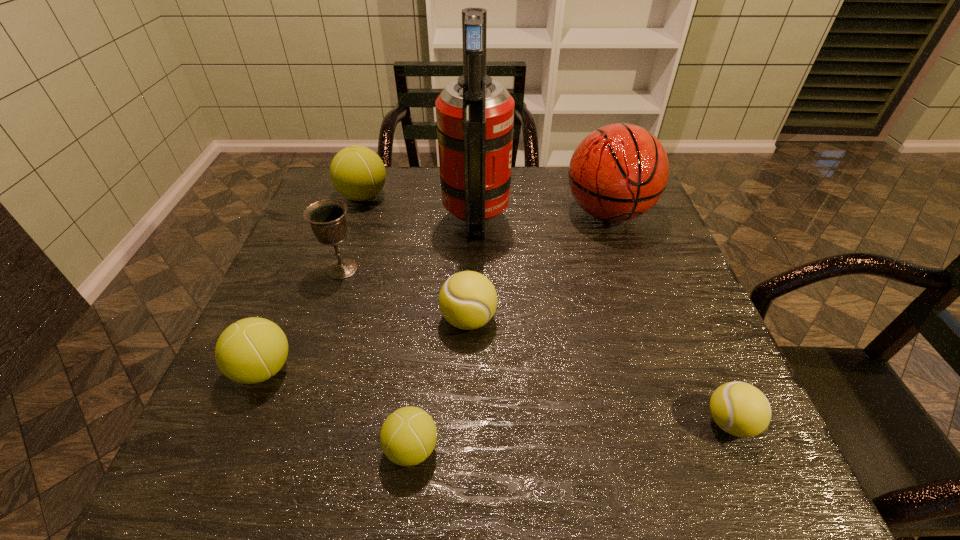
Locate an element on the screen. the third nearest tennis ball is located at coordinates (251, 350).

Find the location of a particular element. The width and height of the screenshot is (960, 540). the smaller yellow tennis ball is located at coordinates (740, 409).

Image resolution: width=960 pixels, height=540 pixels. Identify the location of the rightmost tennis ball. (740, 409).

Where is `the rightmost green tennis ball`? the rightmost green tennis ball is located at coordinates (408, 436).

At what (x,y) coordinates should I click in order to perform the action: click on the smallest green tennis ball. Please return your answer as a coordinate pair (x, y). The height and width of the screenshot is (540, 960). Looking at the image, I should click on (408, 436).

Find the location of a particular element. The height and width of the screenshot is (540, 960). free space located on the front label side of the fire extinguisher is located at coordinates (570, 217).

Find the location of `vacant space located 0.080m on the side with spill of the seventh shortest object`. vacant space located 0.080m on the side with spill of the seventh shortest object is located at coordinates (625, 262).

The image size is (960, 540). Identify the location of vacant space located on the front of the fifth nearest object. (323, 329).

Find the location of `vacant area located 0.070m on the right of the biggest green tennis ball`. vacant area located 0.070m on the right of the biggest green tennis ball is located at coordinates (413, 196).

This screenshot has width=960, height=540. What are the coordinates of `free space located 0.290m on the left of the farther yellow tennis ball` in the screenshot? It's located at (304, 320).